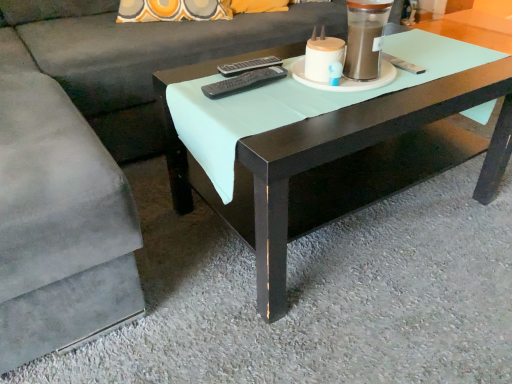
Question: Looking at their shapes, would you say matte white candle holder at upper center is wider or thinner than black plastic remote at center, marked as the first remote in a front-to-back arrangement?

Choices:
 (A) wide
 (B) thin

Answer: (A)

Question: From a real-world perspective, is matte white candle holder at upper center above or below black plastic remote at center, marked as the first remote in a front-to-back arrangement?

Choices:
 (A) above
 (B) below

Answer: (A)

Question: Based on their relative distances, which object is nearer to the black plastic remote at center, marked as the first remote in a front-to-back arrangement?

Choices:
 (A) black plastic remote at center, the 2th remote viewed from the front
 (B) matte white candle holder at upper center
 (C) suede gray couch at center
 (D) matte black coffee table at center

Answer: (A)

Question: Estimate the real-world distances between objects in this image. Which object is closer to the black plastic remote at center, the 2th remote viewed from the back?

Choices:
 (A) matte black coffee table at center
 (B) black plastic remote at center, which is the 1th remote in back-to-front order
 (C) matte white candle holder at upper center
 (D) suede gray couch at center

Answer: (B)